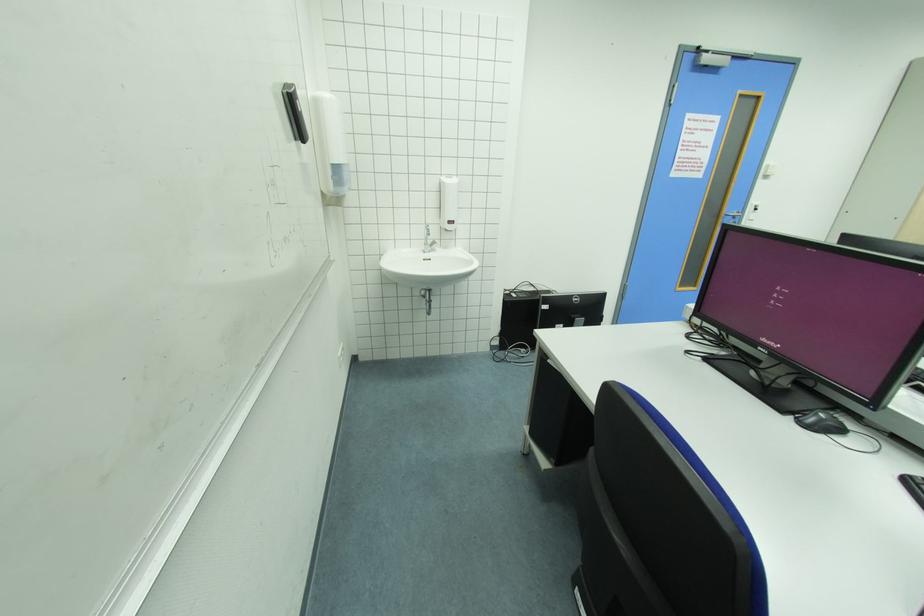
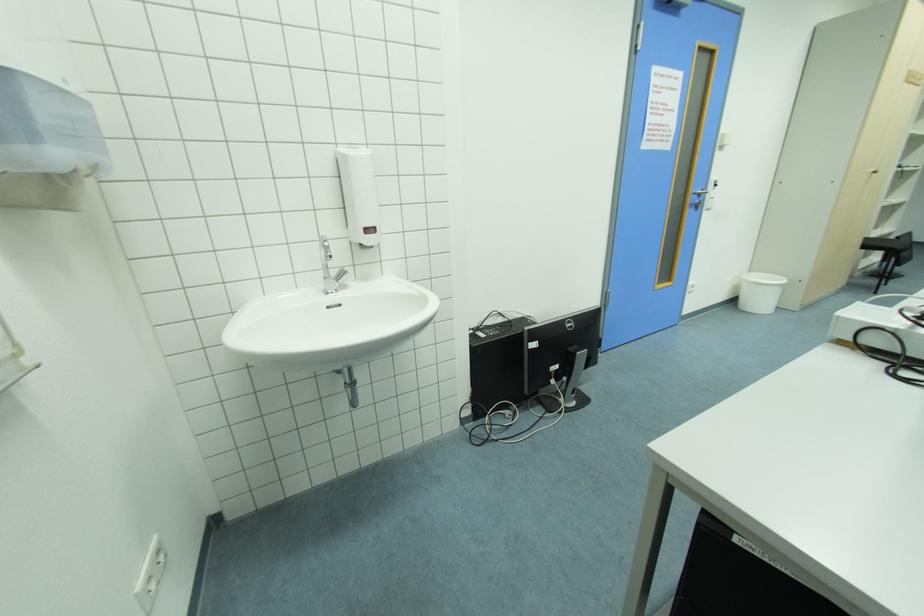
In the second image, find the point that corresponds to [439,244] in the first image.

(347, 274)